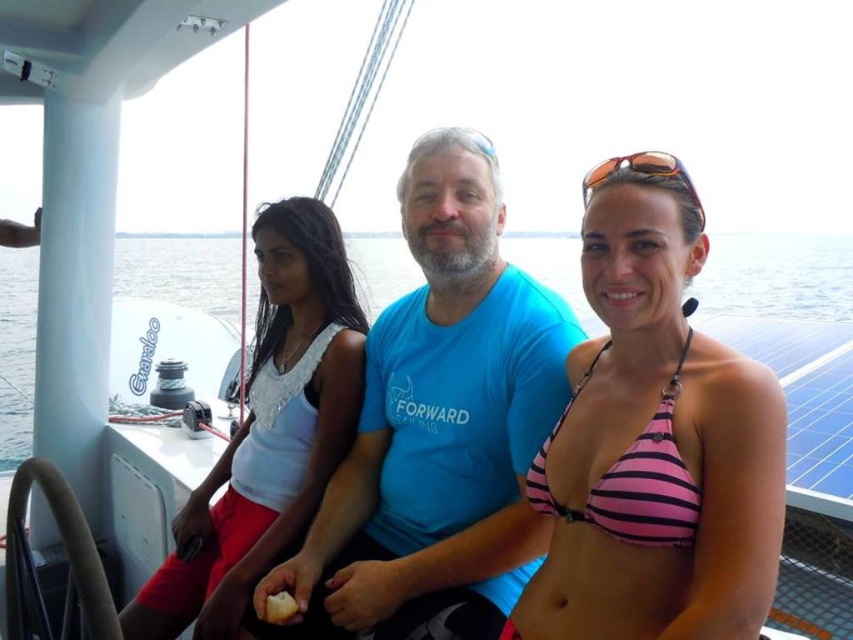
Is pink striped bikini top at center thinner than clear blue water at center?

Yes.

Identify the location of pink striped bikini top at center. The height and width of the screenshot is (640, 853). (654, 442).

This screenshot has height=640, width=853. I want to click on pink striped bikini top at center, so click(x=654, y=442).

How much distance is there between blue t-shirt at center and white lace top at center?

blue t-shirt at center and white lace top at center are 16.71 inches apart.

Which is in front, point (432, 291) or point (306, 292)?

Point (432, 291) is more forward.

Does point (508, 333) lie in front of point (292, 300)?

Yes, point (508, 333) is closer to viewer.

What are the coordinates of `blue t-shirt at center` in the screenshot? It's located at (438, 420).

Does blue t-shirt at center come behind clear blue water at center?

No, it is in front of clear blue water at center.

Between point (405, 548) and point (22, 275), which one is positioned behind?

The point (22, 275) is behind.

Where is `blue t-shirt at center`? blue t-shirt at center is located at coordinates (438, 420).